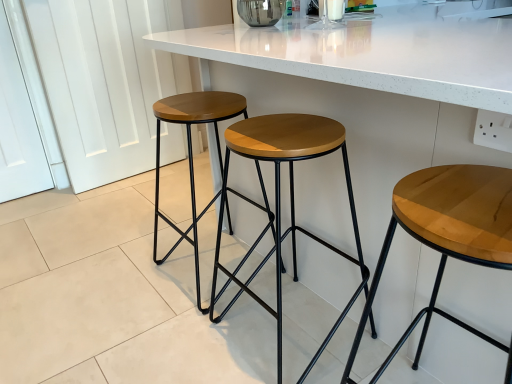
Question: Is woodenmaterial/texturestool at center, positioned as the second stool in right-to-left order, further to camera compared to white marble countertop at center?

Choices:
 (A) yes
 (B) no

Answer: (B)

Question: Considering the relative sizes of woodenmaterial/texturestool at center, the 2th stool when ordered from left to right, and white marble countertop at center in the image provided, is woodenmaterial/texturestool at center, the 2th stool when ordered from left to right, wider than white marble countertop at center?

Choices:
 (A) no
 (B) yes

Answer: (A)

Question: Is woodenmaterial/texturestool at center, the 2th stool when ordered from left to right, beside white marble countertop at center?

Choices:
 (A) no
 (B) yes

Answer: (A)

Question: Is woodenmaterial/texturestool at center, the 2th stool when ordered from left to right, positioned in front of white marble countertop at center?

Choices:
 (A) no
 (B) yes

Answer: (B)

Question: From a real-world perspective, is woodenmaterial/texturestool at center, positioned as the second stool in right-to-left order, located beneath white marble countertop at center?

Choices:
 (A) yes
 (B) no

Answer: (A)

Question: In terms of height, does white marble countertop at center look taller or shorter compared to light brown wood stool at center, the first stool positioned from the right?

Choices:
 (A) tall
 (B) short

Answer: (A)

Question: Looking at the image, does white marble countertop at center seem bigger or smaller compared to light brown wood stool at center, positioned as the third stool in left-to-right order?

Choices:
 (A) big
 (B) small

Answer: (A)

Question: From the image's perspective, is white marble countertop at center located above or below light brown wood stool at center, the first stool positioned from the right?

Choices:
 (A) below
 (B) above

Answer: (B)

Question: Looking at their shapes, would you say white marble countertop at center is wider or thinner than light brown wood stool at center, positioned as the third stool in left-to-right order?

Choices:
 (A) wide
 (B) thin

Answer: (A)

Question: From a real-world perspective, relative to light brown wood stool at center, the first stool positioned from the right, is woodenmaterial/texturestool at center, the 2th stool when ordered from left to right, vertically above or below?

Choices:
 (A) above
 (B) below

Answer: (A)

Question: Is woodenmaterial/texturestool at center, the 2th stool when ordered from left to right, taller or shorter than light brown wood stool at center, positioned as the third stool in left-to-right order?

Choices:
 (A) tall
 (B) short

Answer: (A)

Question: Looking at their shapes, would you say woodenmaterial/texturestool at center, positioned as the second stool in right-to-left order, is wider or thinner than light brown wood stool at center, positioned as the third stool in left-to-right order?

Choices:
 (A) wide
 (B) thin

Answer: (B)

Question: In the image, is woodenmaterial/texturestool at center, the 2th stool when ordered from left to right, positioned in front of or behind light brown wood stool at center, positioned as the third stool in left-to-right order?

Choices:
 (A) front
 (B) behind

Answer: (B)

Question: Is white marble countertop at center to the left or to the right of wooden/matte stool at center, which is the third stool from right to left, in the image?

Choices:
 (A) right
 (B) left

Answer: (A)

Question: Is white marble countertop at center wider or thinner than wooden/matte stool at center, which is the third stool from right to left?

Choices:
 (A) wide
 (B) thin

Answer: (A)